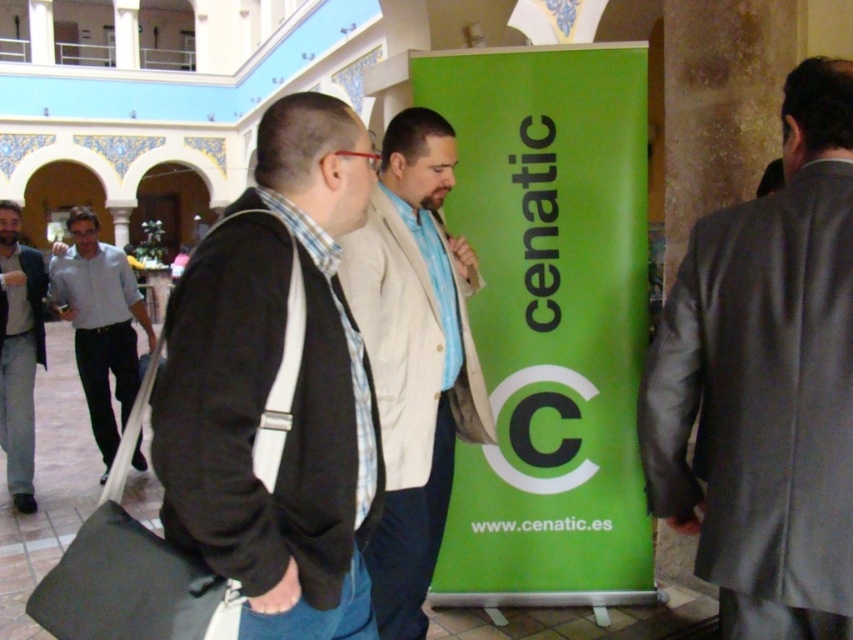
Question: Is light beige jacket at center closer to camera compared to white shirt at left?

Choices:
 (A) no
 (B) yes

Answer: (B)

Question: Which point is farther to the camera?

Choices:
 (A) gray suit at right
 (B) white shirt at left
 (C) light beige jacket at center

Answer: (B)

Question: Observing the image, what is the correct spatial positioning of dark gray sweater at center in reference to white shirt at left?

Choices:
 (A) right
 (B) left

Answer: (A)

Question: Among these points, which one is nearest to the camera?

Choices:
 (A) pyautogui.click(x=96, y=387)
 (B) pyautogui.click(x=393, y=298)

Answer: (B)

Question: Which of the following is the farthest from the observer?

Choices:
 (A) (830, 74)
 (B) (32, 308)
 (C) (366, 324)
 (D) (137, 468)

Answer: (D)

Question: Can you confirm if gray suit at right is smaller than light beige jacket at center?

Choices:
 (A) yes
 (B) no

Answer: (A)